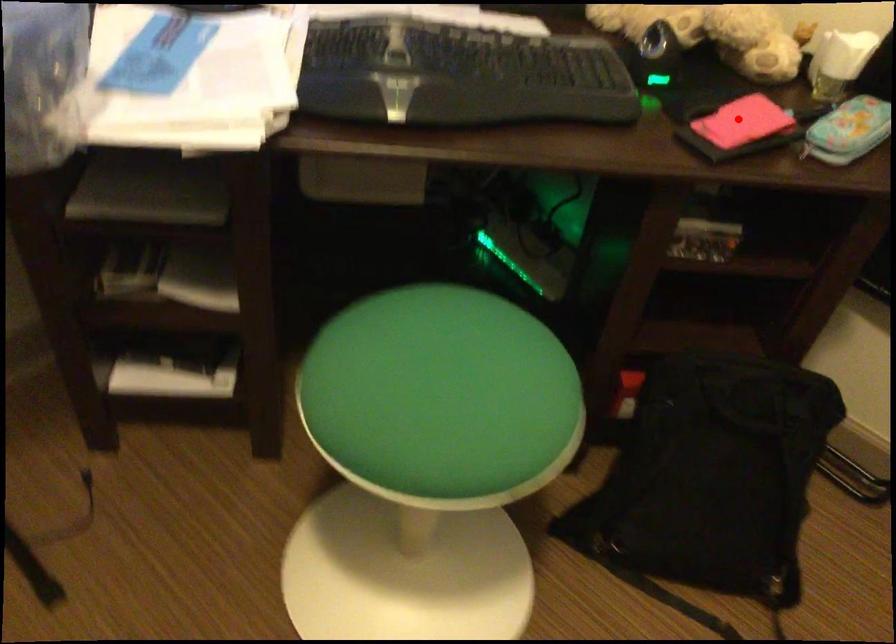
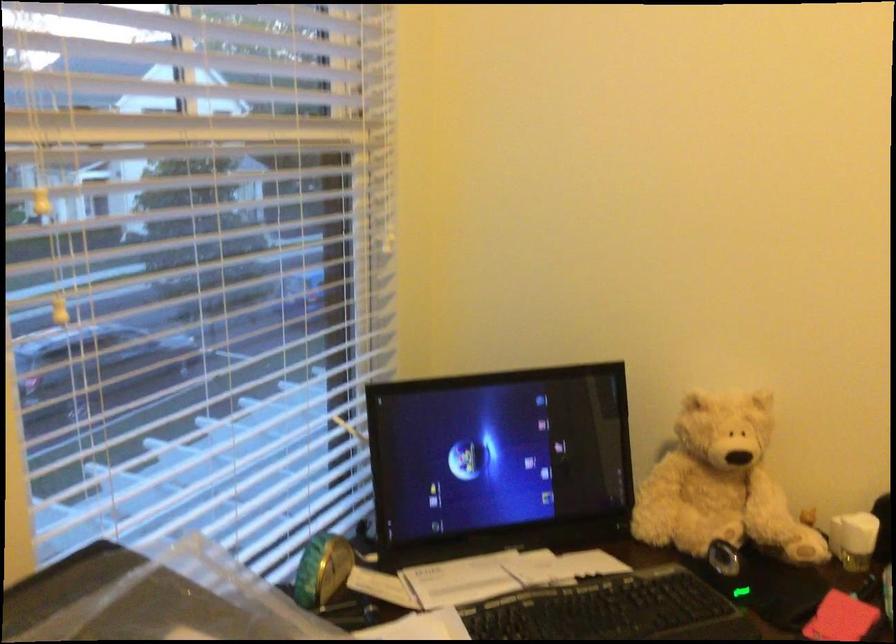
Question: I am providing you with two images of the same scene from different viewpoints. A red point is shown in image1. For the corresponding object point in image2, is it positioned nearer or farther from the camera?

Choices:
 (A) Nearer
 (B) Farther

Answer: (B)